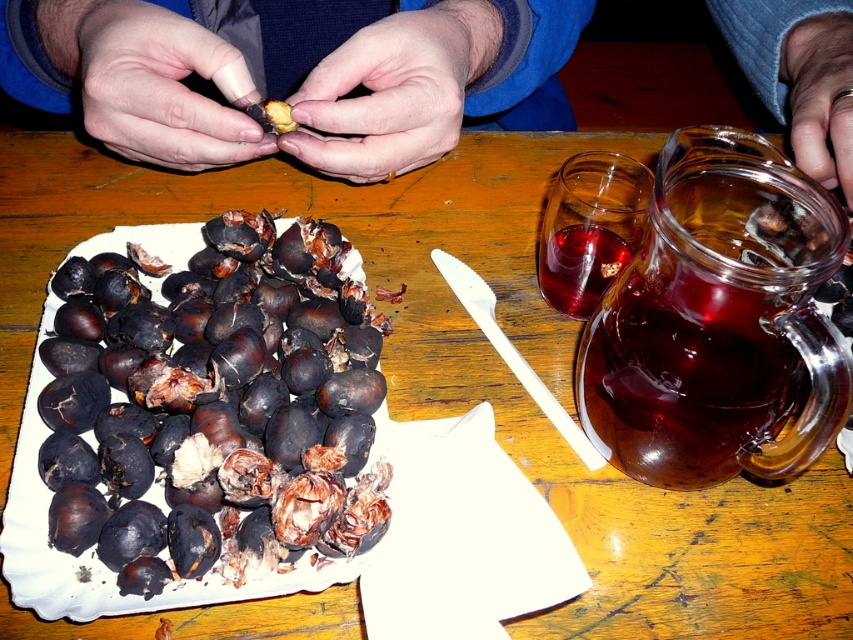
You are setting up a table for a chestnut roasting party. You have a black matte chestnuts at lower left and a transparent glass jar at upper right. Which item should you place first if you want to ensure stability?

The black matte chestnuts at lower left should be placed first because it has a larger size compared to the transparent glass jar at upper right, making it more stable as a base.

You are a chef who needs to place a 25 cm tall chestnut soup pot on the table. The transparent glass jar at upper right is in the way. Can you fit the pot without moving the jar?

The transparent glass jar at upper right is 24.69 centimeters from the viewer. Since the pot is 25 cm tall, it might not fit as the jar is closer than the pot is tall, potentially causing an obstruction.